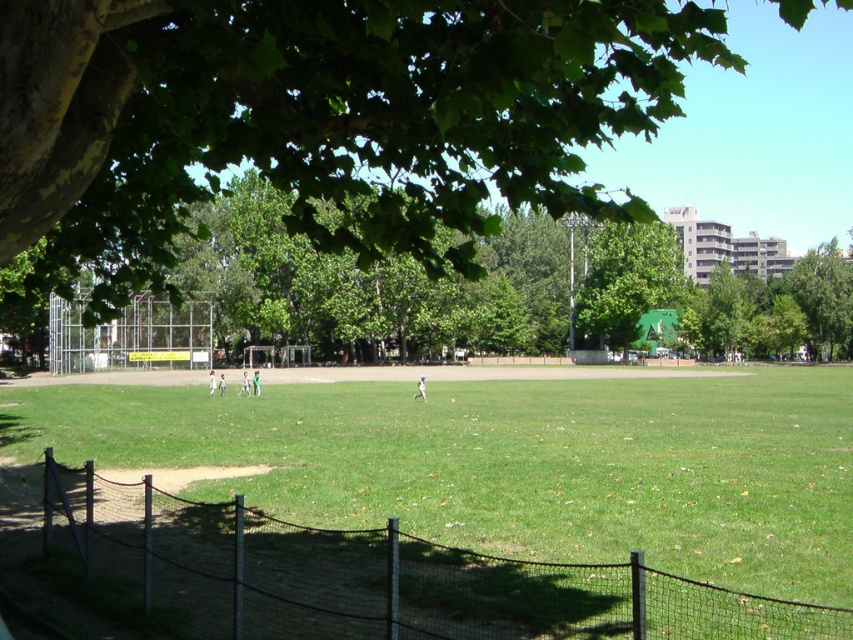
Question: Can you confirm if black mesh fence at lower left is wider than green leafy tree at center?

Choices:
 (A) yes
 (B) no

Answer: (B)

Question: Which point is closer to the camera?

Choices:
 (A) (186, 106)
 (B) (608, 260)

Answer: (A)

Question: Which is nearer to the green leafy tree at upper left?

Choices:
 (A) green leafy tree at center
 (B) black mesh fence at lower left
 (C) metallic wire fence at left

Answer: (C)

Question: Is green leafy tree at upper left positioned in front of green leafy tree at center?

Choices:
 (A) yes
 (B) no

Answer: (A)

Question: Does black mesh fence at lower left appear on the left side of metallic wire fence at left?

Choices:
 (A) yes
 (B) no

Answer: (B)

Question: Estimate the real-world distances between objects in this image. Which object is farther from the green leafy tree at center?

Choices:
 (A) metallic wire fence at left
 (B) black mesh fence at lower left

Answer: (B)